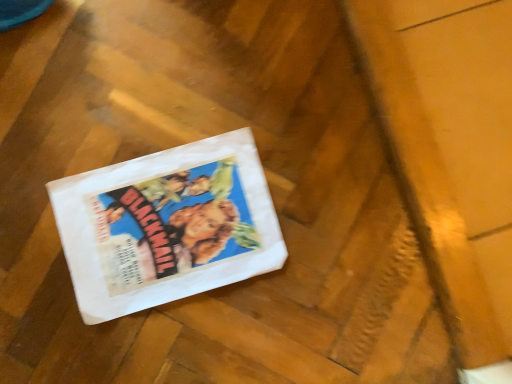
This screenshot has height=384, width=512. Identify the location of vacant area on top of white paperboard at center (from a real-world perspective). (167, 212).